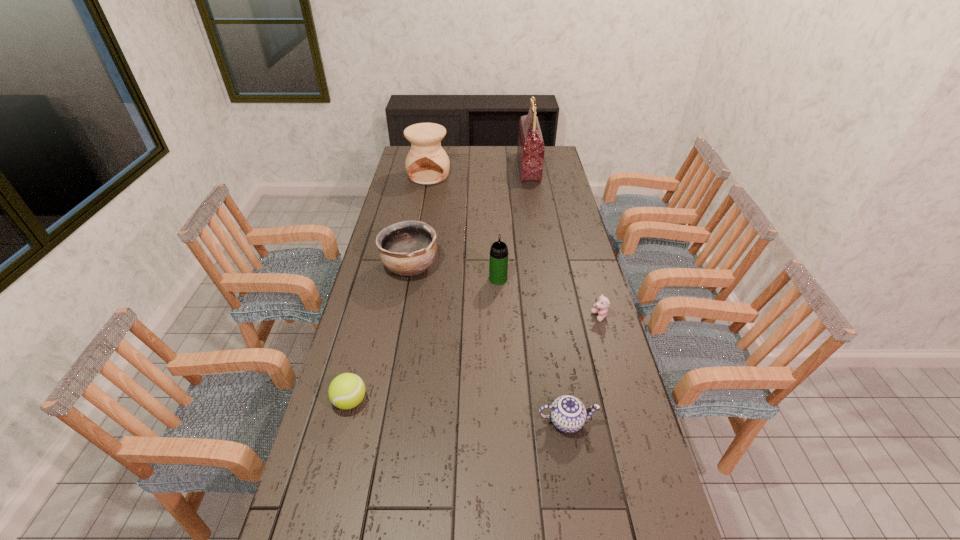
Locate an element on the screen. object that is at the far left corner is located at coordinates (427, 163).

Where is `object that is at the far right corner`? This screenshot has width=960, height=540. object that is at the far right corner is located at coordinates (530, 150).

Locate an element on the screen. This screenshot has height=540, width=960. free region at the far edge of the desktop is located at coordinates (473, 157).

In the image, there is a desktop. At what (x,y) coordinates should I click in order to perform the action: click on vacant space at the left edge. Please return your answer as a coordinate pair (x, y). This screenshot has height=540, width=960. Looking at the image, I should click on (367, 443).

Identify the location of vacant area at the right edge of the desktop. (x=562, y=175).

The width and height of the screenshot is (960, 540). I want to click on vacant point located between the chinaware and the tennis ball, so click(x=458, y=411).

The width and height of the screenshot is (960, 540). Find the location of `free space that is in between the tallest object and the shorter pottery`. free space that is in between the tallest object and the shorter pottery is located at coordinates (469, 217).

Locate an element on the screen. empty location between the tallest object and the second tallest object is located at coordinates (479, 171).

Find the location of a particular element. vacant space that's between the thermos bottle and the fourth tallest object is located at coordinates (454, 273).

You are a GUI agent. You are given a task and a screenshot of the screen. Output one action in this format:
    pyautogui.click(x=<x>, y=<y>)
    Task: Click on the free space between the taller pottery and the handbag
    The width and height of the screenshot is (960, 540).
    Given the screenshot: What is the action you would take?
    pyautogui.click(x=479, y=171)